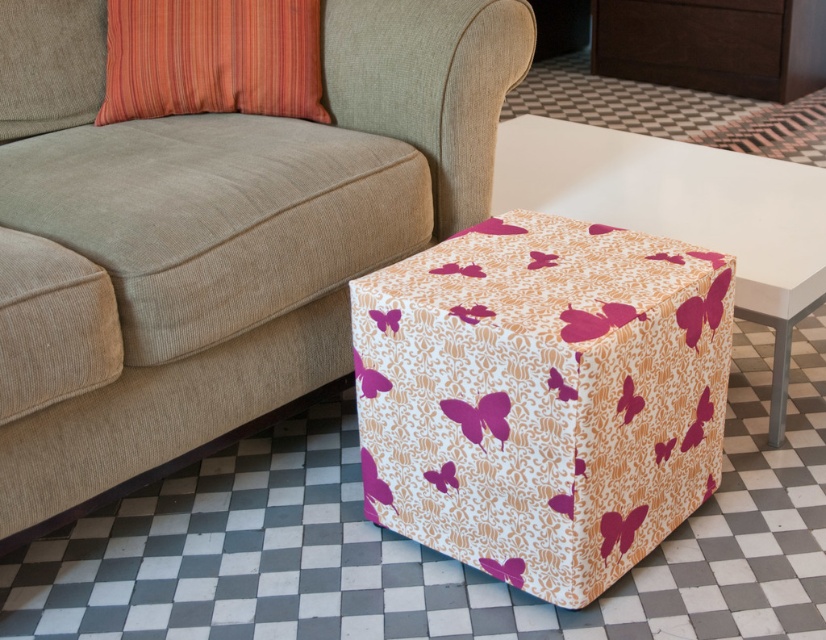
Question: Is white fabric with pink butterflies at lower right further to the viewer compared to orange striped pillow at upper left?

Choices:
 (A) no
 (B) yes

Answer: (A)

Question: Which object is closer to the camera taking this photo?

Choices:
 (A) orange striped pillow at upper left
 (B) beige fabric couch at lower left

Answer: (B)

Question: Based on their relative distances, which object is farther from the matte pink fabric cube at center?

Choices:
 (A) beige fabric couch at lower left
 (B) white fabric with pink butterflies at lower right
 (C) orange striped pillow at upper left

Answer: (C)

Question: Which of the following is the farthest from the observer?

Choices:
 (A) (131, 36)
 (B) (692, 250)
 (C) (639, 212)
 (D) (12, 182)

Answer: (C)

Question: Is white fabric with pink butterflies at lower right to the left of orange striped pillow at upper left from the viewer's perspective?

Choices:
 (A) no
 (B) yes

Answer: (A)

Question: Observing the image, what is the correct spatial positioning of beige fabric couch at lower left in reference to matte pink fabric cube at center?

Choices:
 (A) below
 (B) above

Answer: (B)